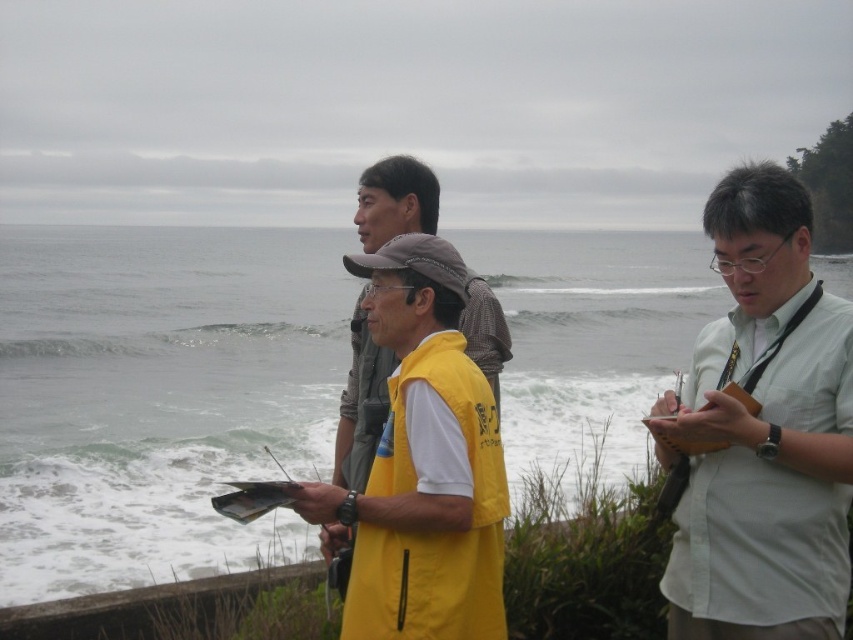
You are a photographer planning to take a photo of the white frothy water at center and the white shirt at right. Given that your camera can focus on objects within a 200 feet range, will both subjects be in focus?

The white frothy water at center and white shirt at right are 267.63 feet apart, which exceeds the camera focus range of 200 feet. Therefore, both subjects cannot be in focus simultaneously.